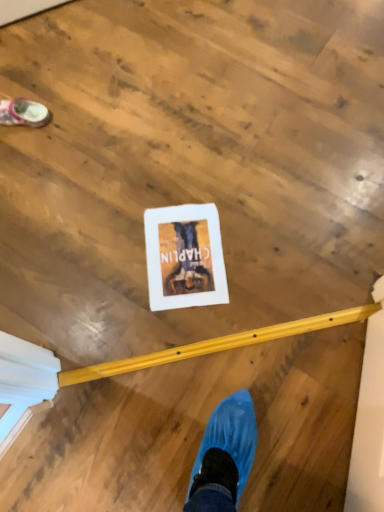
Find the location of a particular element. free location in front of white fabric shoe at upper left is located at coordinates (30, 160).